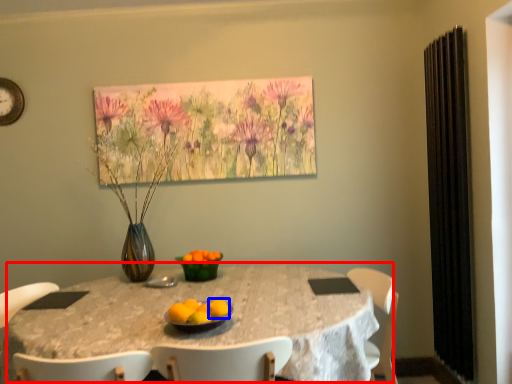
Question: Which point is closer to the camera, table (highlighted by a red box) or orange (highlighted by a blue box)?

Choices:
 (A) table
 (B) orange

Answer: (A)